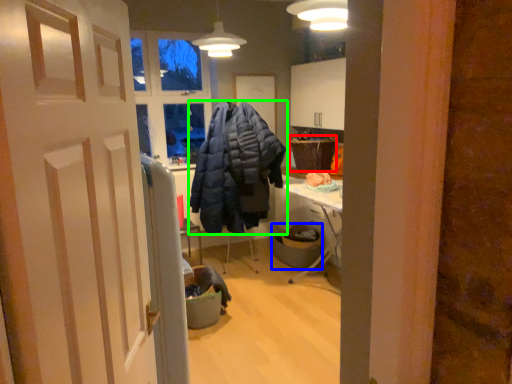
Question: Which object is the farthest from picnic basket (highlighted by a red box)? Choose among these: trash bin/can (highlighted by a blue box) or jacket (highlighted by a green box).

Choices:
 (A) trash bin/can
 (B) jacket

Answer: (B)